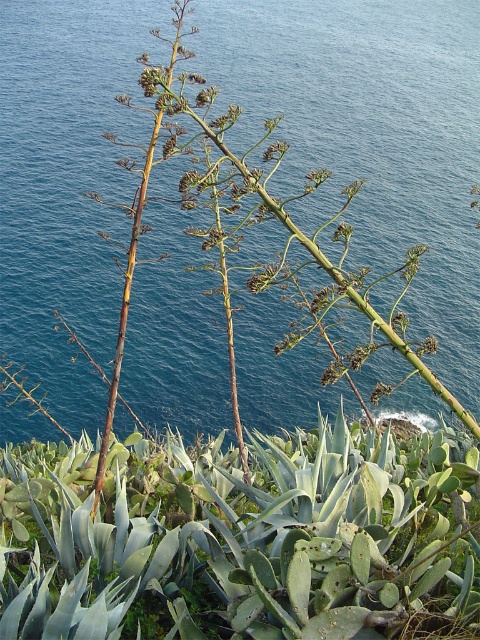
Question: Among these points, which one is nearest to the camera?

Choices:
 (A) pyautogui.click(x=9, y=461)
 (B) pyautogui.click(x=319, y=109)

Answer: (A)

Question: Does blue liquid water at center appear under green succulent at center?

Choices:
 (A) no
 (B) yes

Answer: (A)

Question: Is blue liquid water at center wider than green succulent at center?

Choices:
 (A) yes
 (B) no

Answer: (A)

Question: From the image, what is the correct spatial relationship of blue liquid water at center in relation to green succulent at center?

Choices:
 (A) right
 (B) left

Answer: (B)